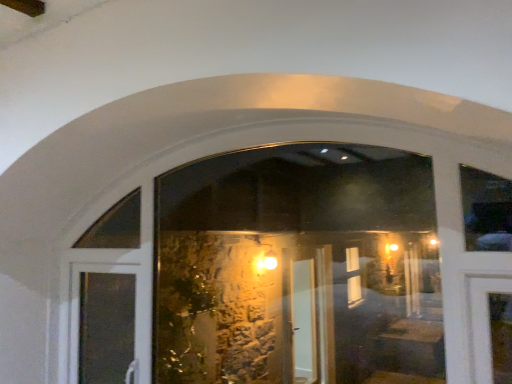
Question: Does matte glass door at lower left have a greater height compared to transparent glass door at center?

Choices:
 (A) yes
 (B) no

Answer: (B)

Question: From a real-world perspective, is matte glass door at lower left beneath transparent glass door at center?

Choices:
 (A) no
 (B) yes

Answer: (B)

Question: Considering the relative positions of matte glass door at lower left and transparent glass door at center in the image provided, is matte glass door at lower left behind transparent glass door at center?

Choices:
 (A) yes
 (B) no

Answer: (A)

Question: Can you confirm if matte glass door at lower left is bigger than transparent glass door at center?

Choices:
 (A) no
 (B) yes

Answer: (A)

Question: Is matte glass door at lower left thinner than transparent glass door at center?

Choices:
 (A) yes
 (B) no

Answer: (B)

Question: Considering the relative sizes of matte glass door at lower left and transparent glass door at center in the image provided, is matte glass door at lower left shorter than transparent glass door at center?

Choices:
 (A) no
 (B) yes

Answer: (B)

Question: Is transparent glass door at center turned away from matte glass door at lower left?

Choices:
 (A) no
 (B) yes

Answer: (B)

Question: Is transparent glass door at center oriented towards matte glass door at lower left?

Choices:
 (A) no
 (B) yes

Answer: (B)

Question: Is transparent glass door at center to the left of matte glass door at lower left from the viewer's perspective?

Choices:
 (A) yes
 (B) no

Answer: (B)

Question: Can matte glass door at lower left be found inside transparent glass door at center?

Choices:
 (A) yes
 (B) no

Answer: (A)

Question: Is transparent glass door at center wider than matte glass door at lower left?

Choices:
 (A) no
 (B) yes

Answer: (A)

Question: Is transparent glass door at center further to camera compared to matte glass door at lower left?

Choices:
 (A) yes
 (B) no

Answer: (B)

Question: In terms of height, does matte glass door at lower left look taller or shorter compared to transparent glass door at center?

Choices:
 (A) tall
 (B) short

Answer: (B)